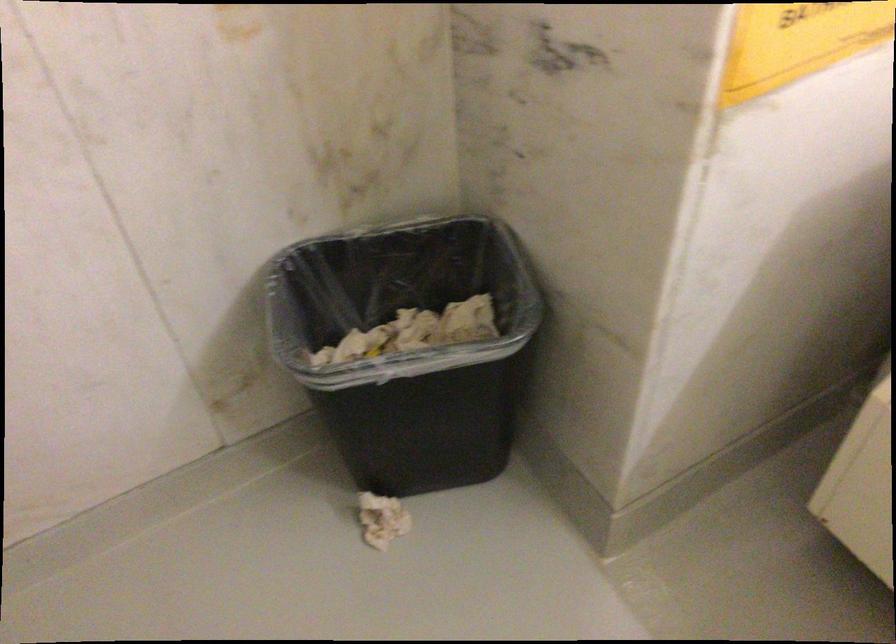
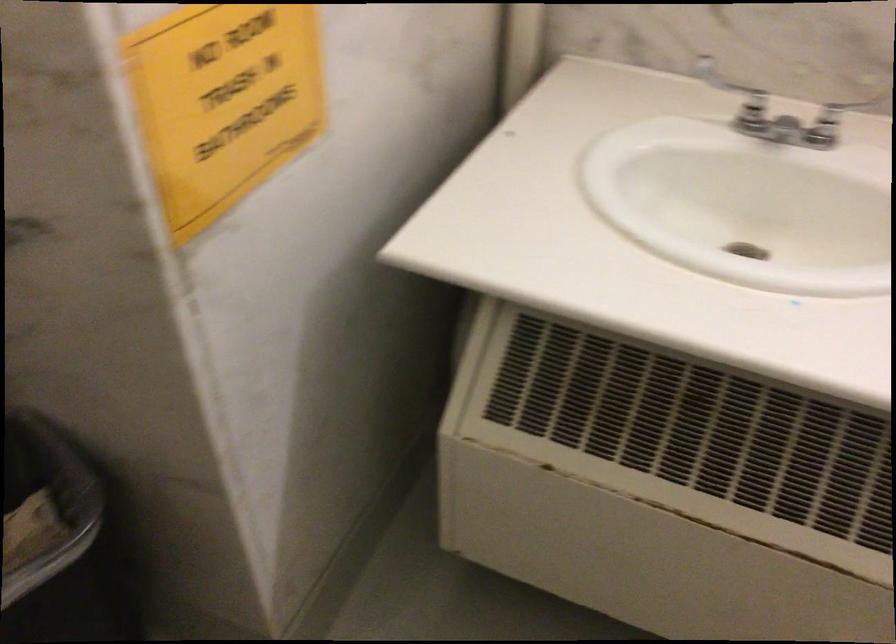
Question: Based on the continuous images, in which direction is the camera rotating? Reply with the corresponding letter.

Choices:
 (A) Left
 (B) Right
 (C) Up
 (D) Down

Answer: (B)